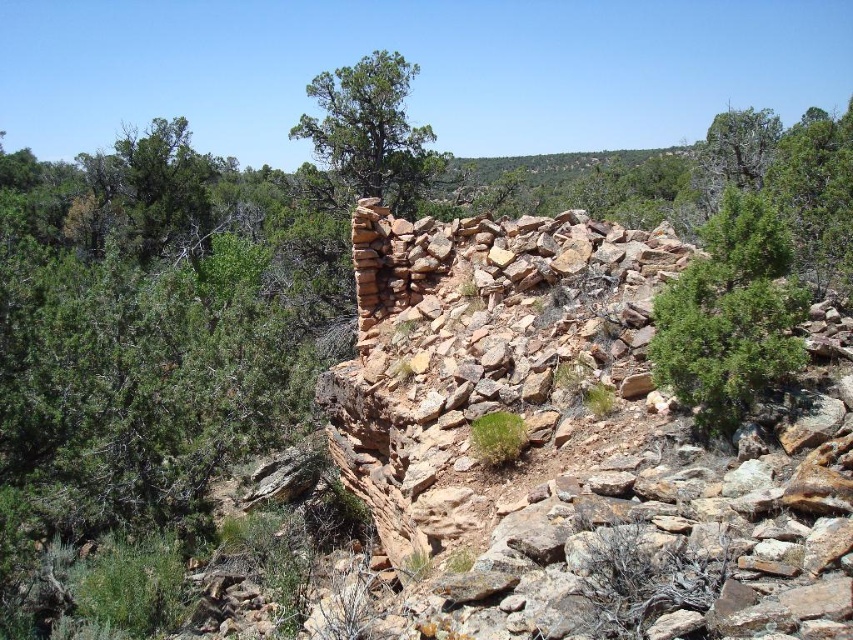
Question: Is green rough textured tree at upper right positioned at the back of green textured tree at upper center?

Choices:
 (A) yes
 (B) no

Answer: (B)

Question: Which is nearer to the green leafy tree at upper right?

Choices:
 (A) green textured tree at upper center
 (B) green rough textured tree at upper right

Answer: (B)

Question: Does green rough textured tree at upper right appear on the left side of green leafy tree at upper right?

Choices:
 (A) yes
 (B) no

Answer: (A)

Question: Does green rough textured tree at upper right have a smaller size compared to green leafy tree at upper right?

Choices:
 (A) no
 (B) yes

Answer: (B)

Question: Which point is closer to the camera?

Choices:
 (A) green leafy tree at upper right
 (B) green rough textured tree at upper right

Answer: (B)

Question: Which is nearer to the green textured tree at upper center?

Choices:
 (A) green leafy tree at upper right
 (B) green rough textured tree at upper right

Answer: (A)